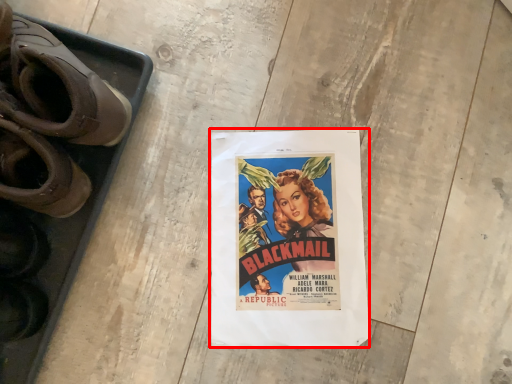
Question: From the image's perspective, where is poster (annotated by the red box) located relative to footwear?

Choices:
 (A) above
 (B) below

Answer: (B)